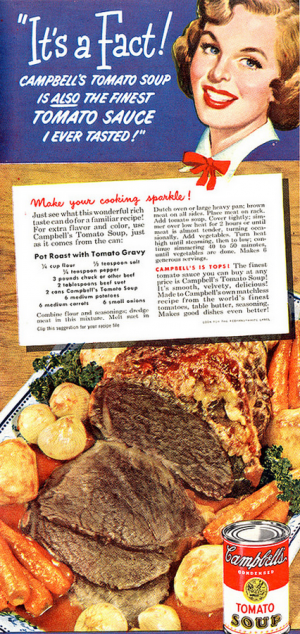
Locate an element on the screen. The image size is (300, 634). plate is located at coordinates (5, 425).